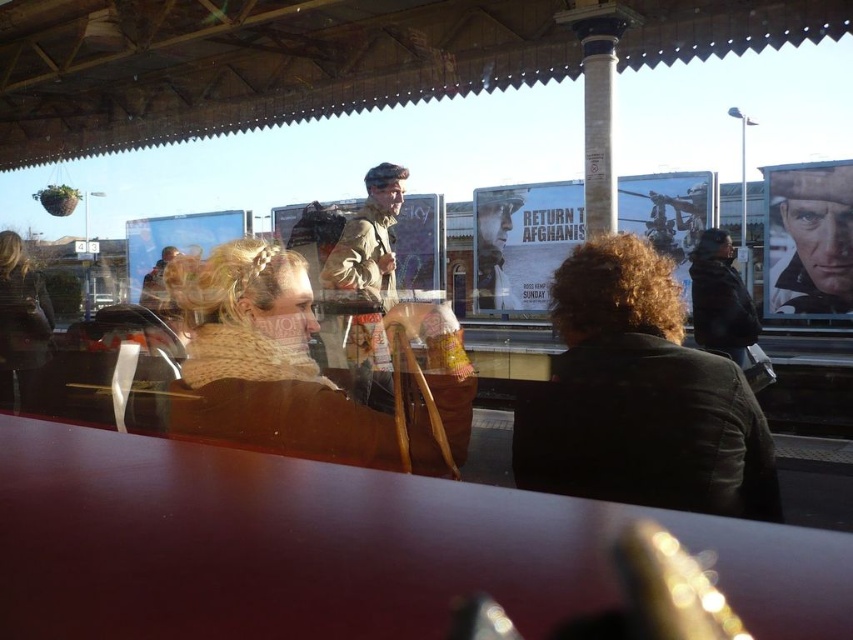
You are standing on the train station platform and want to walk from point A to point B. Point A is located at coordinates point (840, 216) and point B is at point (738, 358). Which point is closer to you when you start walking?

Point (840, 216) is closer to you than point (738, 358) because it is further to the viewer, meaning it is physically nearer in the scene.

What is the object located at the coordinates point (808,240) in the image?

The object located at point (808,240) is the smooth leather jacket at upper right.

You are standing at the train station platform and see a point marked at coordinates (808, 240). Based on the scene description, can you identify what object this point is located on?

The point at coordinates (808, 240) is located on the smooth leather jacket at upper right.